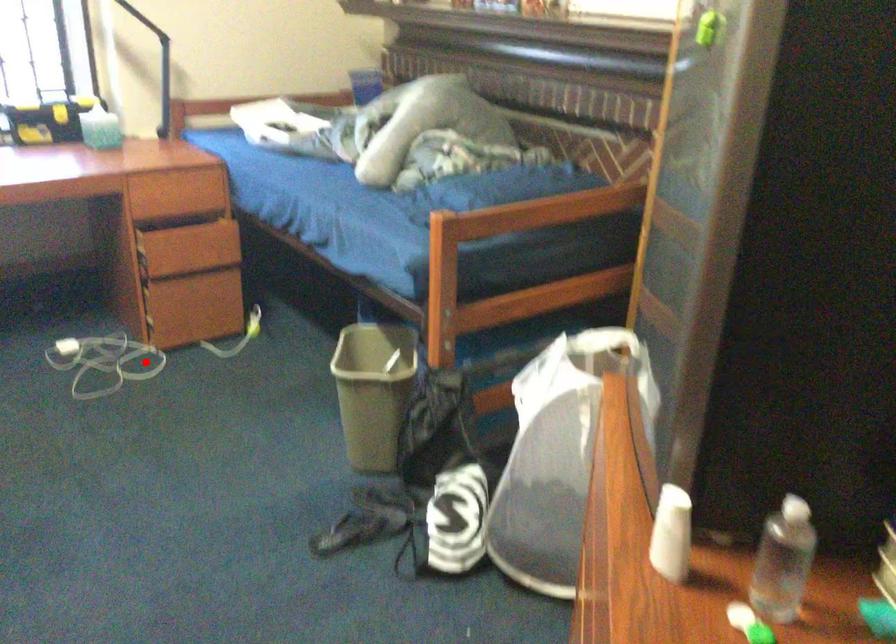
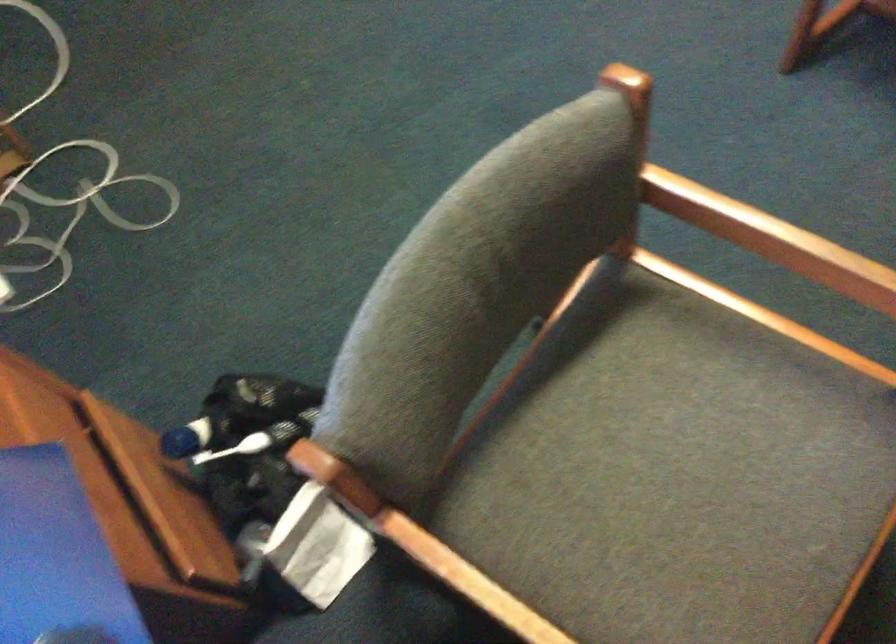
Question: A red point is marked in image1. In image2, is the corresponding 3D point closer to the camera or farther? Reply with the corresponding letter.

Choices:
 (A) The corresponding 3D point is closer.
 (B) The corresponding 3D point is farther.

Answer: (A)